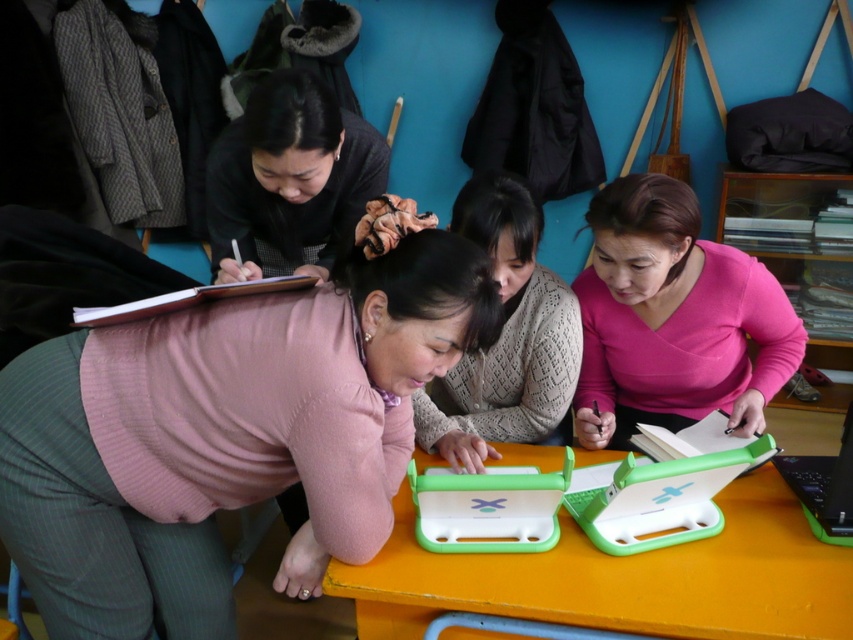
Is yellow plastic table at center below matte pink sweater at center?

Yes, yellow plastic table at center is below matte pink sweater at center.

Which is more to the right, yellow plastic table at center or matte pink sweater at center?

From the viewer's perspective, yellow plastic table at center appears more on the right side.

I want to click on yellow plastic table at center, so click(622, 577).

Locate an element on the screen. This screenshot has height=640, width=853. yellow plastic table at center is located at coordinates (622, 577).

Does matte pink sweater at center have a lesser width compared to green plastic laptop at lower right?

In fact, matte pink sweater at center might be wider than green plastic laptop at lower right.

Who is more distant from viewer, [496,385] or [846,504]?

The point [496,385] is behind.

Is point (498, 195) farther from viewer compared to point (844, 497)?

Yes.

The height and width of the screenshot is (640, 853). Identify the location of matte pink sweater at center. [x=505, y=337].

Can you confirm if pink ribbed sweater at center is positioned below matte pink sweater at center?

Yes, pink ribbed sweater at center is below matte pink sweater at center.

Is point (442, 312) positioned in front of point (517, 184)?

Yes.

Does point (90, 419) come in front of point (469, 428)?

Yes, point (90, 419) is in front of point (469, 428).

Image resolution: width=853 pixels, height=640 pixels. Find the location of `pink ribbed sweater at center`. pink ribbed sweater at center is located at coordinates (223, 435).